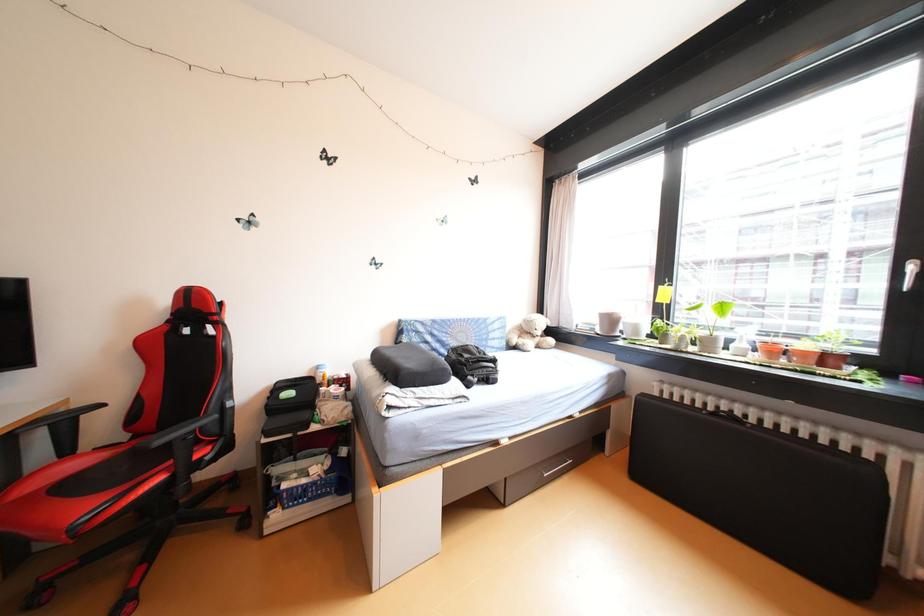
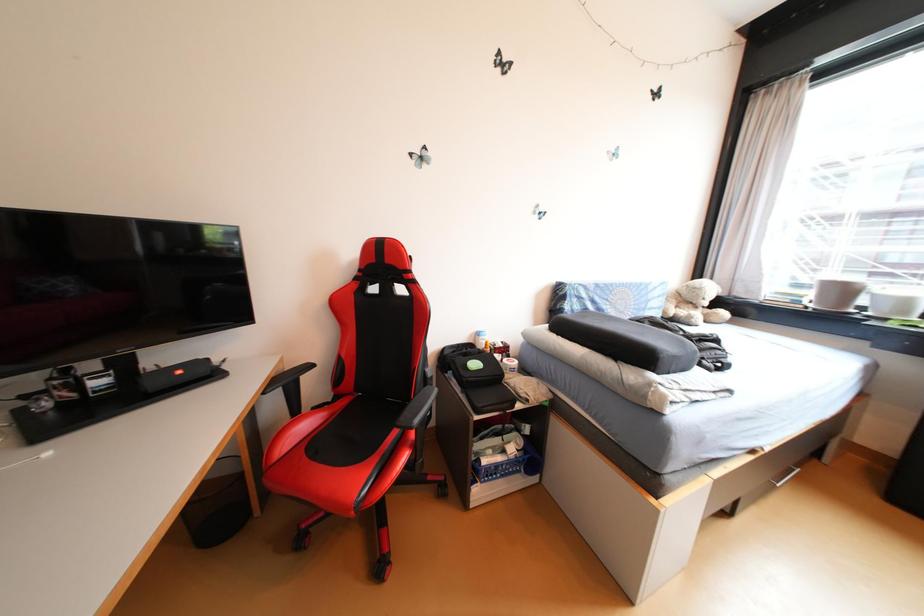
Question: The first image is from the beginning of the video and the second image is from the end. How did the camera likely rotate when shooting the video?

Choices:
 (A) Left
 (B) Right
 (C) Up
 (D) Down

Answer: (A)